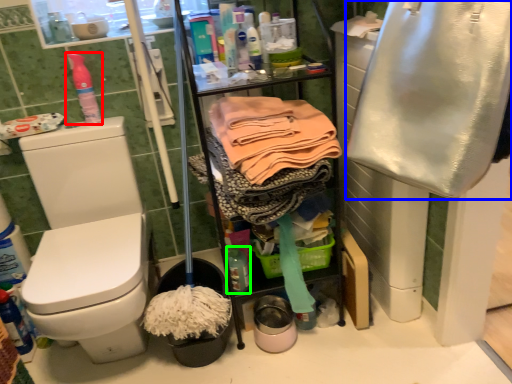
Question: Estimate the real-world distances between objects in this image. Which object is closer to cleaning product (highlighted by a red box), clothing (highlighted by a blue box) or bottle (highlighted by a green box)?

Choices:
 (A) clothing
 (B) bottle

Answer: (B)